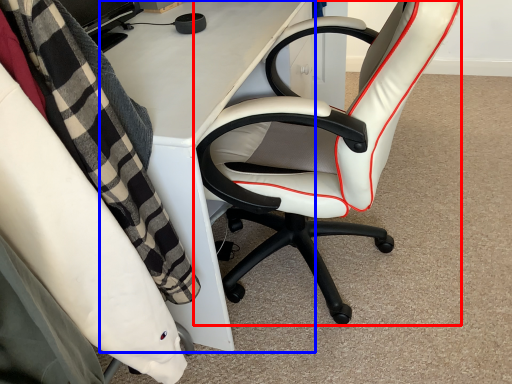
Question: Among these objects, which one is nearest to the camera, chair (highlighted by a red box) or desk (highlighted by a blue box)?

Choices:
 (A) chair
 (B) desk

Answer: (A)